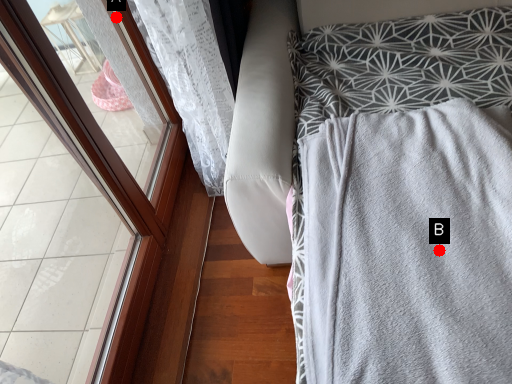
Question: Two points are circled on the image, labeled by A and B beside each circle. Which of the following is the farthest from the observer?

Choices:
 (A) A is further
 (B) B is further

Answer: (A)